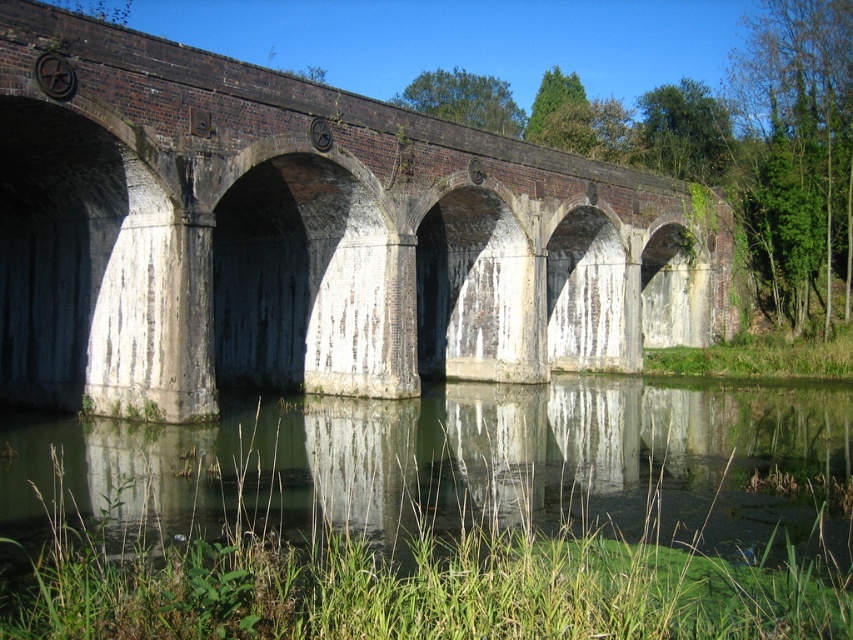
Question: Which of the following is the closest to the observer?

Choices:
 (A) green algae-covered water at lower center
 (B) brick bridge at center

Answer: (A)

Question: Can you confirm if brick bridge at center is bigger than green algae-covered water at lower center?

Choices:
 (A) yes
 (B) no

Answer: (A)

Question: Can you confirm if brick bridge at center is positioned above green algae-covered water at lower center?

Choices:
 (A) yes
 (B) no

Answer: (A)

Question: Observing the image, what is the correct spatial positioning of brick bridge at center in reference to green algae-covered water at lower center?

Choices:
 (A) below
 (B) above

Answer: (B)

Question: Which point is farther to the camera?

Choices:
 (A) (397, 397)
 (B) (474, 410)

Answer: (B)